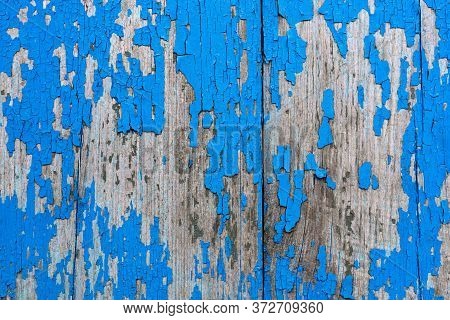
Locate an element on the screen. blue paint is located at coordinates pyautogui.click(x=38, y=106), pyautogui.click(x=139, y=80), pyautogui.click(x=207, y=54), pyautogui.click(x=430, y=113), pyautogui.click(x=403, y=251), pyautogui.click(x=138, y=253), pyautogui.click(x=21, y=221).